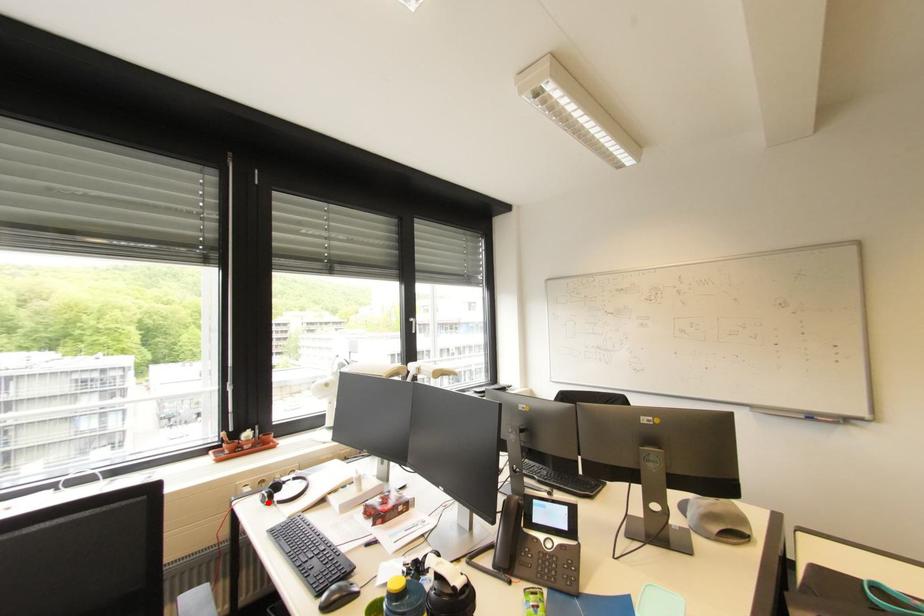
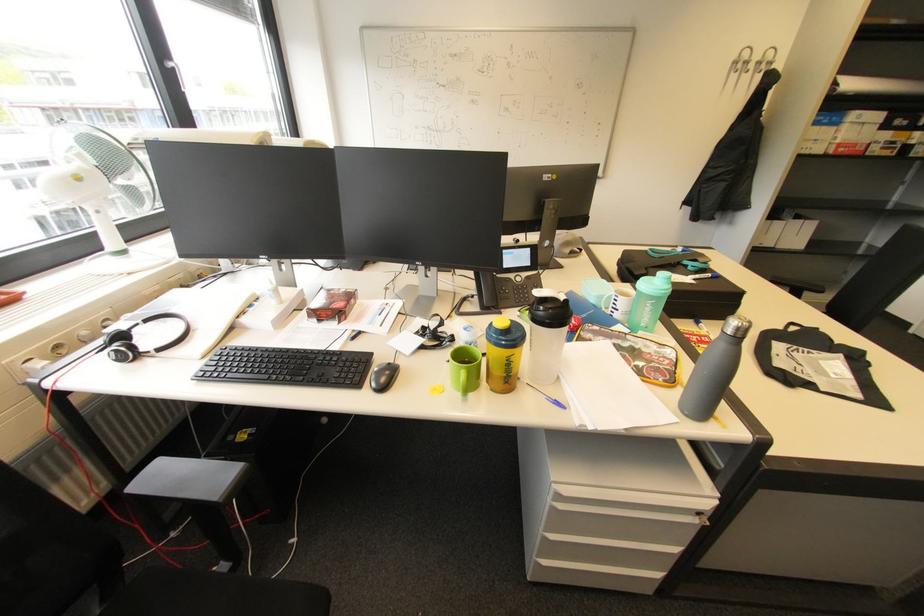
Where in the second image is the point corresponding to the highlighted location from the first image?

(127, 361)